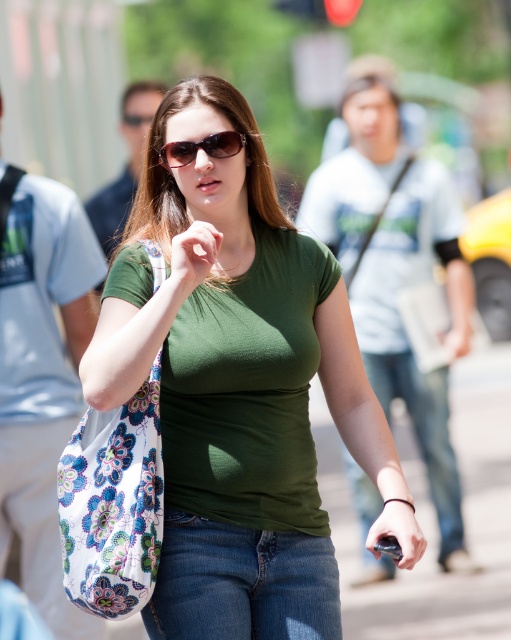
Can you confirm if floral-patterned fabric bag at left is bigger than jeans at center?

No.

Does point (81, 556) come behind point (428, 397)?

That is False.

Locate an element on the screen. The height and width of the screenshot is (640, 511). floral-patterned fabric bag at left is located at coordinates (113, 502).

Does denim jeans at lower center appear over jeans at center?

Yes, denim jeans at lower center is above jeans at center.

Describe the element at coordinates (242, 582) in the screenshot. I see `denim jeans at lower center` at that location.

Describe the element at coordinates (242, 582) in the screenshot. This screenshot has height=640, width=511. I see `denim jeans at lower center` at that location.

The image size is (511, 640). Identify the location of denim jeans at lower center. (242, 582).

Is floral-patterned fabric bag at left above matte black sunglasses at center?

Incorrect, floral-patterned fabric bag at left is not positioned above matte black sunglasses at center.

Does floral-patterned fabric bag at left have a greater width compared to matte black sunglasses at center?

Indeed, floral-patterned fabric bag at left has a greater width compared to matte black sunglasses at center.

Is point (72, 435) farther from viewer compared to point (185, 163)?

Yes, point (72, 435) is behind point (185, 163).

In order to click on floral-patterned fabric bag at left in this screenshot , I will do `click(113, 502)`.